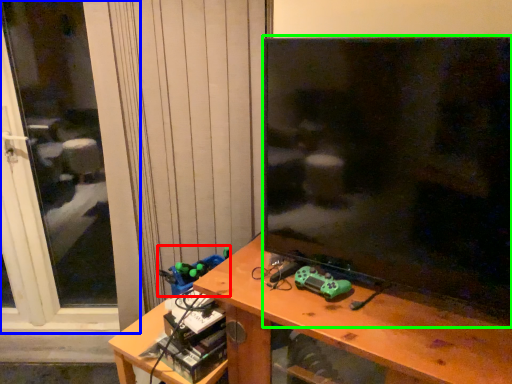
Question: Which object is the closest to the toy (highlighted by a red box)? Choose among these: screen door (highlighted by a blue box) or television (highlighted by a green box).

Choices:
 (A) screen door
 (B) television

Answer: (B)